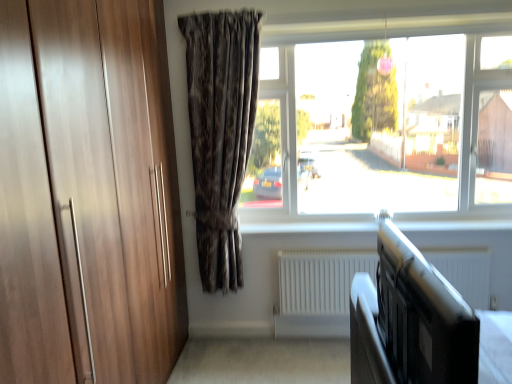
Question: Is transparent glass window at center placed right next to black matte bed frame at lower right?

Choices:
 (A) no
 (B) yes

Answer: (A)

Question: From the image's perspective, does transparent glass window at center appear lower than black matte bed frame at lower right?

Choices:
 (A) no
 (B) yes

Answer: (A)

Question: Considering the relative sizes of transparent glass window at center and black matte bed frame at lower right in the image provided, is transparent glass window at center taller than black matte bed frame at lower right?

Choices:
 (A) no
 (B) yes

Answer: (B)

Question: Does transparent glass window at center contain black matte bed frame at lower right?

Choices:
 (A) yes
 (B) no

Answer: (B)

Question: Is transparent glass window at center positioned before black matte bed frame at lower right?

Choices:
 (A) no
 (B) yes

Answer: (A)

Question: Considering the positions of dark brown textured curtain at center and white matte radiator at lower center in the image, is dark brown textured curtain at center wider or thinner than white matte radiator at lower center?

Choices:
 (A) wide
 (B) thin

Answer: (A)

Question: From their relative heights in the image, would you say dark brown textured curtain at center is taller or shorter than white matte radiator at lower center?

Choices:
 (A) tall
 (B) short

Answer: (A)

Question: Does point (241, 251) appear closer or farther from the camera than point (310, 296)?

Choices:
 (A) farther
 (B) closer

Answer: (A)

Question: From the image's perspective, is dark brown textured curtain at center above or below white matte radiator at lower center?

Choices:
 (A) below
 (B) above

Answer: (B)

Question: Is black matte bed frame at lower right in front of or behind white matte radiator at lower center in the image?

Choices:
 (A) behind
 (B) front

Answer: (B)

Question: Considering the positions of point (361, 322) and point (287, 281), is point (361, 322) closer or farther from the camera than point (287, 281)?

Choices:
 (A) closer
 (B) farther

Answer: (A)

Question: Is black matte bed frame at lower right bigger or smaller than white matte radiator at lower center?

Choices:
 (A) small
 (B) big

Answer: (A)

Question: From a real-world perspective, is black matte bed frame at lower right positioned above or below white matte radiator at lower center?

Choices:
 (A) below
 (B) above

Answer: (B)

Question: Considering their positions, is dark brown textured curtain at center located in front of or behind black matte bed frame at lower right?

Choices:
 (A) behind
 (B) front

Answer: (A)

Question: In terms of width, does dark brown textured curtain at center look wider or thinner when compared to black matte bed frame at lower right?

Choices:
 (A) thin
 (B) wide

Answer: (B)